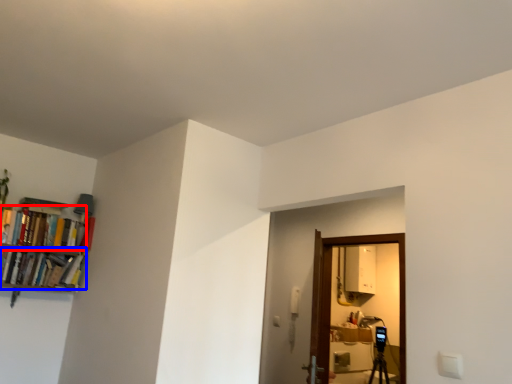
Question: Which of the following is the farthest to the observer, book (highlighted by a red box) or book (highlighted by a blue box)?

Choices:
 (A) book
 (B) book

Answer: (A)